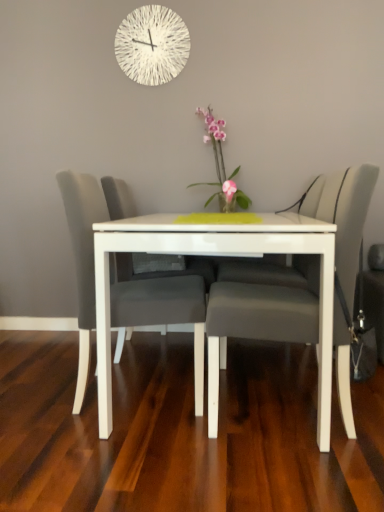
Question: Does matte gray chair at center, which ranks as the second chair in left-to-right order, have a lesser width compared to pink glossy vase at center?

Choices:
 (A) no
 (B) yes

Answer: (A)

Question: Is matte gray chair at center, the first chair viewed from the right, taller than pink glossy vase at center?

Choices:
 (A) no
 (B) yes

Answer: (B)

Question: Considering the relative sizes of matte gray chair at center, the first chair viewed from the right, and pink glossy vase at center in the image provided, is matte gray chair at center, the first chair viewed from the right, smaller than pink glossy vase at center?

Choices:
 (A) no
 (B) yes

Answer: (A)

Question: Considering the relative sizes of matte gray chair at center, the first chair viewed from the right, and pink glossy vase at center in the image provided, is matte gray chair at center, the first chair viewed from the right, bigger than pink glossy vase at center?

Choices:
 (A) yes
 (B) no

Answer: (A)

Question: Is matte gray chair at center, the first chair viewed from the right, far from pink glossy vase at center?

Choices:
 (A) yes
 (B) no

Answer: (B)

Question: From the image's perspective, is pink glossy vase at center above or below white textured clock at upper center?

Choices:
 (A) below
 (B) above

Answer: (A)

Question: Relative to white textured clock at upper center, is pink glossy vase at center in front or behind?

Choices:
 (A) behind
 (B) front

Answer: (B)

Question: Considering the relative positions of pink glossy vase at center and white textured clock at upper center in the image provided, is pink glossy vase at center to the left or to the right of white textured clock at upper center?

Choices:
 (A) left
 (B) right

Answer: (B)

Question: In terms of width, does pink glossy vase at center look wider or thinner when compared to white textured clock at upper center?

Choices:
 (A) thin
 (B) wide

Answer: (B)

Question: In the image, is white glossy table at center positioned in front of or behind white textured clock at upper center?

Choices:
 (A) front
 (B) behind

Answer: (A)

Question: Is point (332, 351) closer or farther from the camera than point (135, 31)?

Choices:
 (A) closer
 (B) farther

Answer: (A)

Question: Considering the positions of white glossy table at center and white textured clock at upper center in the image, is white glossy table at center wider or thinner than white textured clock at upper center?

Choices:
 (A) wide
 (B) thin

Answer: (A)

Question: Is white glossy table at center bigger or smaller than white textured clock at upper center?

Choices:
 (A) big
 (B) small

Answer: (A)

Question: Is matte gray chair at center, the first chair viewed from the right, wider or thinner than white textured clock at upper center?

Choices:
 (A) wide
 (B) thin

Answer: (A)

Question: Is matte gray chair at center, the first chair viewed from the right, bigger or smaller than white textured clock at upper center?

Choices:
 (A) big
 (B) small

Answer: (A)